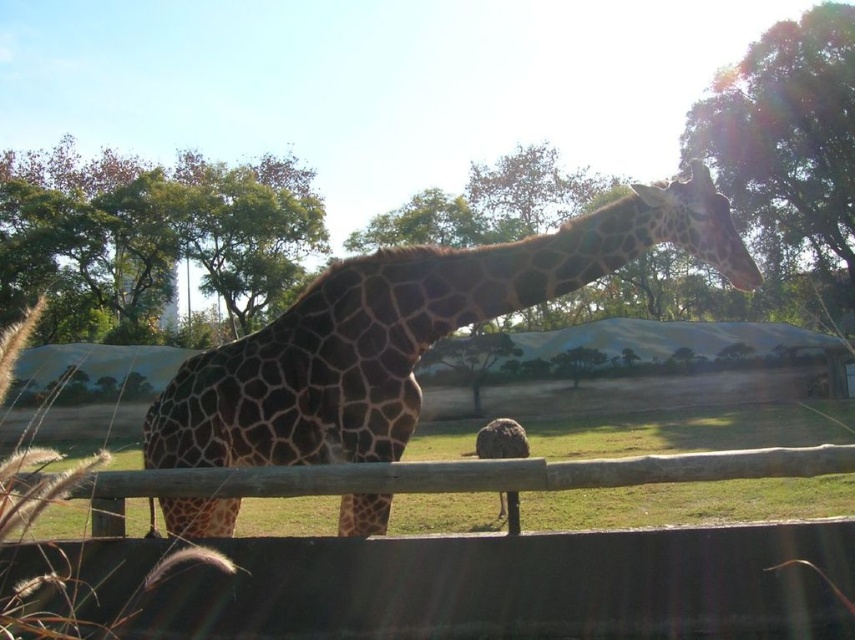
Can you confirm if brown spotted giraffe at center is positioned to the left of wooden fence at center?

Indeed, brown spotted giraffe at center is positioned on the left side of wooden fence at center.

Is brown spotted giraffe at center bigger than wooden fence at center?

Yes, brown spotted giraffe at center is bigger than wooden fence at center.

Between point (384, 531) and point (626, 467), which one is positioned behind?

Positioned behind is point (384, 531).

The image size is (855, 640). I want to click on brown spotted giraffe at center, so click(x=404, y=333).